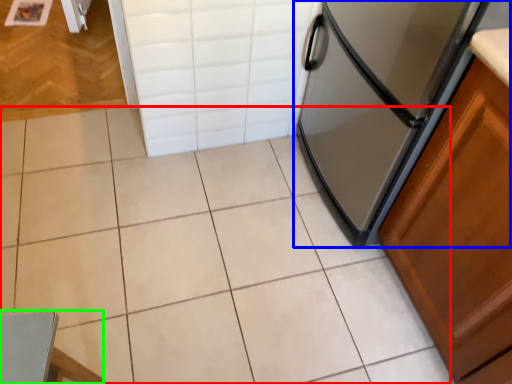
Question: Which object is positioned closest to ceramic tile (highlighted by a red box)? Select from refrigerator (highlighted by a blue box) and chair (highlighted by a green box).

Choices:
 (A) refrigerator
 (B) chair

Answer: (A)